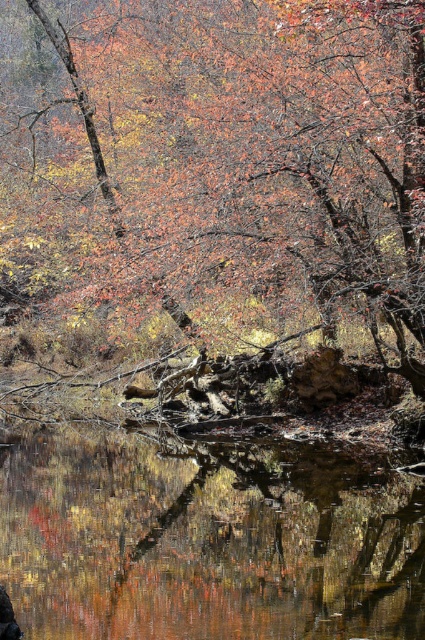
Does autumn leaves at center have a lesser height compared to transparent water at center?

No, autumn leaves at center is not shorter than transparent water at center.

Where is `autumn leaves at center`? The width and height of the screenshot is (425, 640). autumn leaves at center is located at coordinates (218, 163).